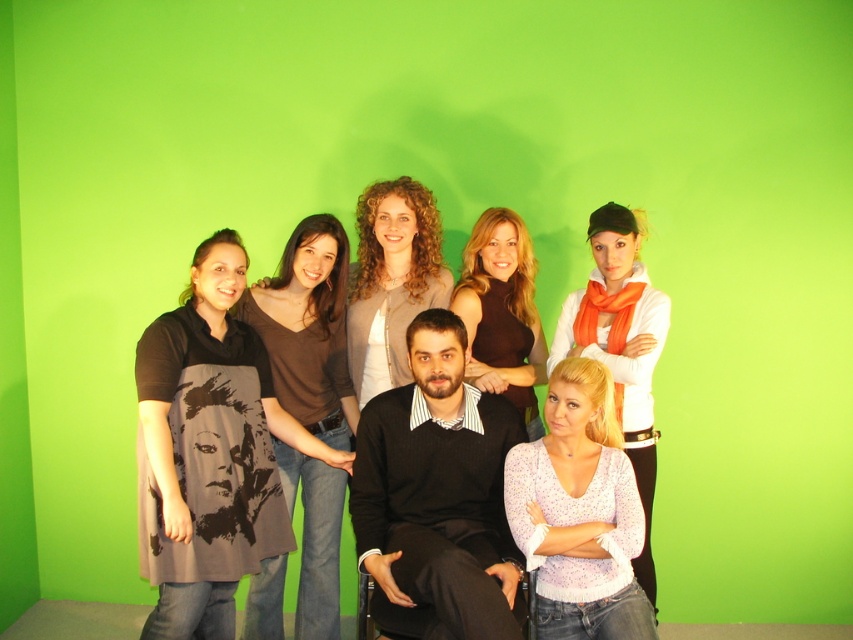
You are a photographer adjusting the lighting in a studio setup. You notice the dark brown jersey at center and want to ensure it receives even illumination. Considering its position at point 0.514, 0.362, how would you adjust the lights to properly light this area?

The dark brown jersey at center is located at point (308, 328). To ensure even illumination, position the main light slightly to the left of this coordinate and the fill light to the right, maintaining a balanced distance to avoid harsh shadows.